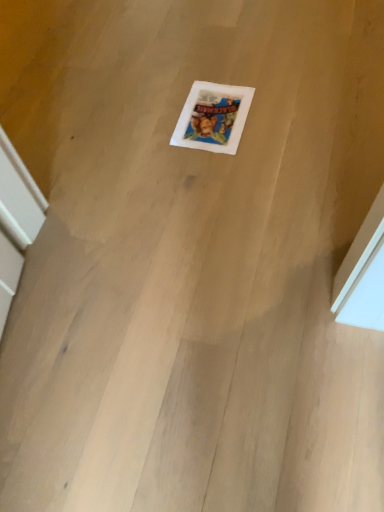
Locate an element on the screen. This screenshot has height=512, width=384. free location to the left of white matte picture frame at center is located at coordinates (143, 125).